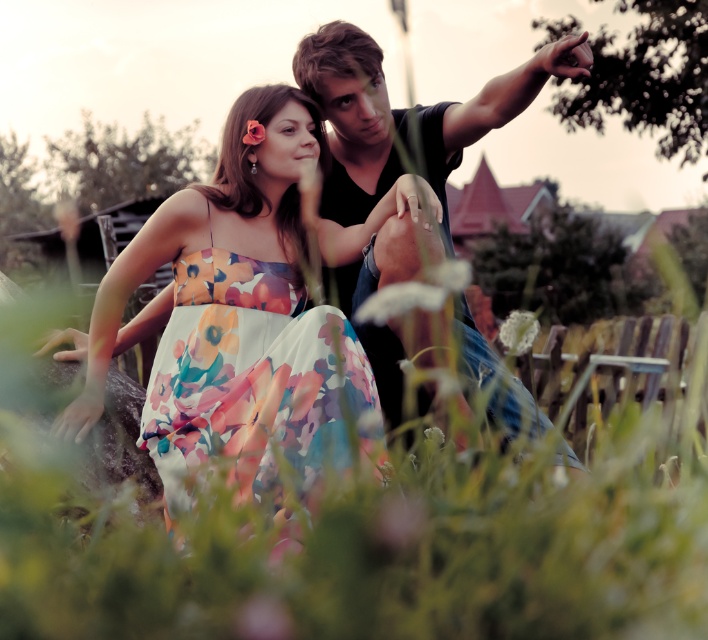
Question: Which point is farther to the camera?

Choices:
 (A) (249, 122)
 (B) (428, 268)

Answer: (A)

Question: Is green grass at lower center positioned behind floral silk dress at center?

Choices:
 (A) no
 (B) yes

Answer: (A)

Question: Does white matte flower at center have a lesser width compared to soft pink petal at center?

Choices:
 (A) yes
 (B) no

Answer: (B)

Question: Which object is positioned closest to the green grass at lower center?

Choices:
 (A) white matte flower at lower center
 (B) floral print dress at center
 (C) smooth black shirt at upper right

Answer: (B)

Question: Based on their relative distances, which object is nearer to the soft pink petal at center?

Choices:
 (A) white matte flower at center
 (B) green grass at lower center

Answer: (A)

Question: Does smooth black shirt at upper right lie behind white matte flower at center?

Choices:
 (A) no
 (B) yes

Answer: (A)